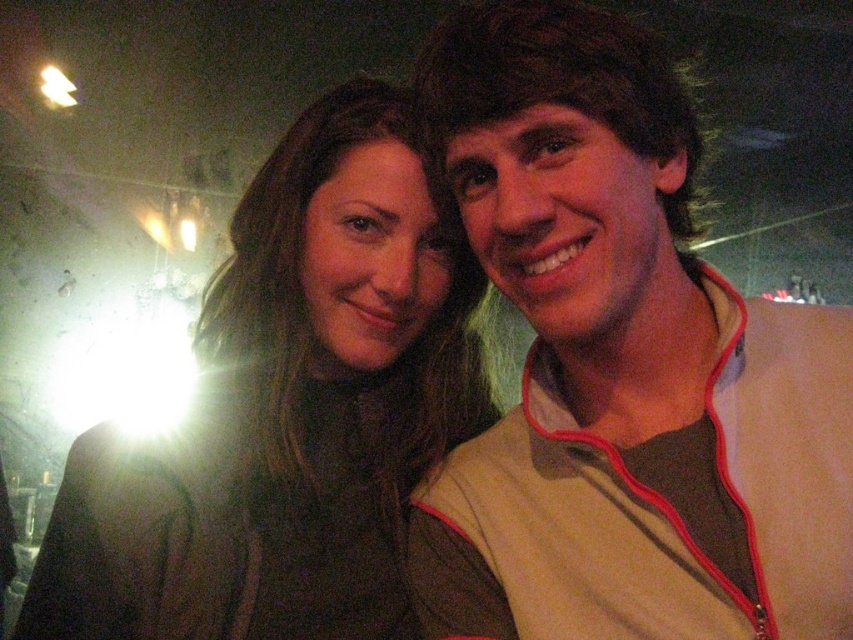
You are a photographer adjusting the lighting for a portrait. You notice the tan fabric jacket at upper right and the matte black jacket at center in the frame. Which jacket will reflect more light and potentially cause glare in the photo?

The tan fabric jacket at upper right is thinner than the matte black jacket at center, so it may reflect more light and cause more glare in the photo.

You are a photographer holding a camera that requires the subject to be at least 24 inches away to focus properly. You are taking a photo of the tan fabric jacket at upper right. Based on the scene description, will the jacket be in focus?

The tan fabric jacket at upper right is only 23.24 inches away from the viewer, which is less than the required 24 inches for proper focus. Therefore, the jacket will not be in focus.

You are a photographer trying to adjust the lighting for a portrait. You notice the tan fabric jacket at upper right and the matte black jacket at center in your frame. Which jacket should you focus the light on to ensure proper exposure, considering their sizes?

The tan fabric jacket at upper right has a lesser height compared to the matte black jacket at center, so you should focus the light on the matte black jacket at center since it is larger and requires more even lighting for proper exposure.